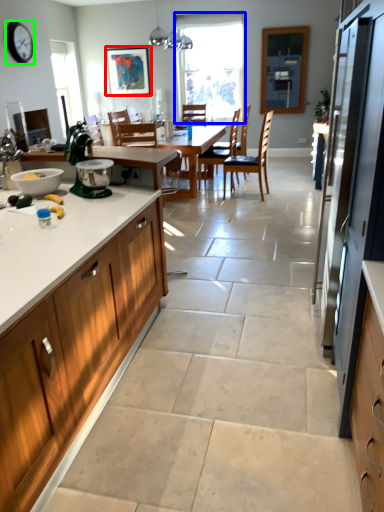
Question: Which object is the farthest from picture frame (highlighted by a red box)? Choose among these: window (highlighted by a blue box) or clock (highlighted by a green box).

Choices:
 (A) window
 (B) clock

Answer: (B)